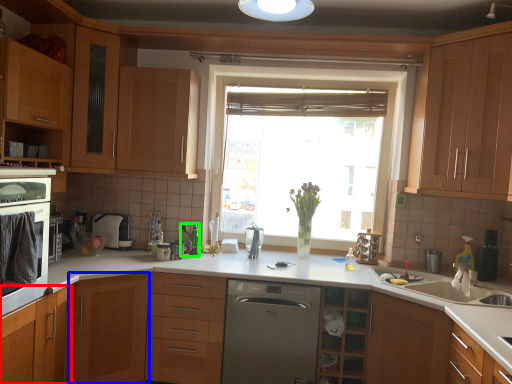
Question: Considering the real-world distances, which object is closest to cabinetry (highlighted by a red box)? cabinetry (highlighted by a blue box) or faucet (highlighted by a green box).

Choices:
 (A) cabinetry
 (B) faucet

Answer: (A)